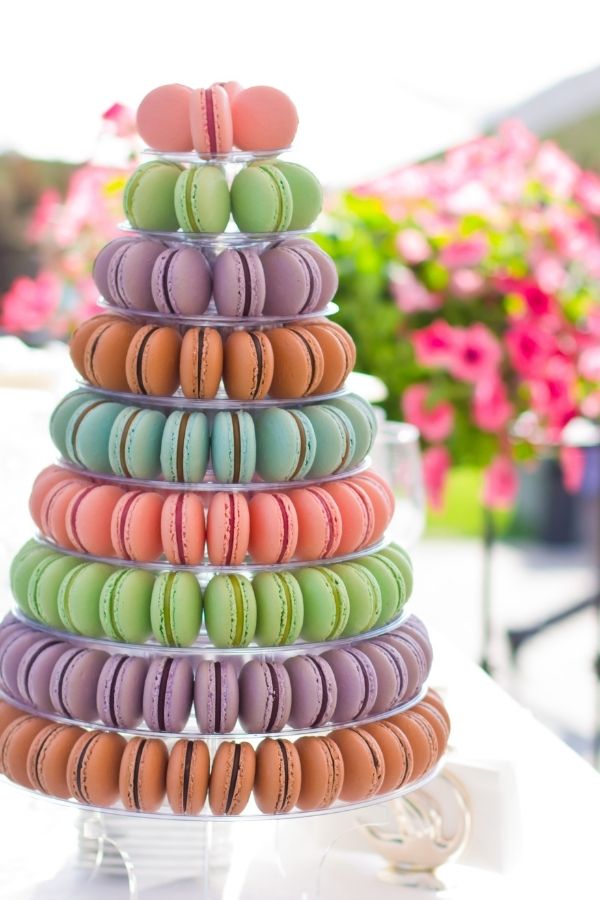
Where is `plates`? plates is located at coordinates (112, 868), (112, 856).